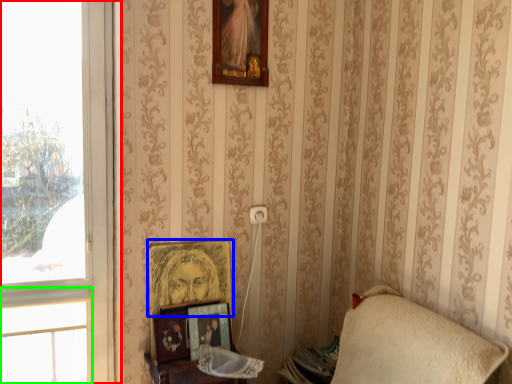
Question: Considering the real-world distances, which object is farthest from window (highlighted by a red box)? picture frame (highlighted by a blue box) or window (highlighted by a green box)?

Choices:
 (A) picture frame
 (B) window

Answer: (A)